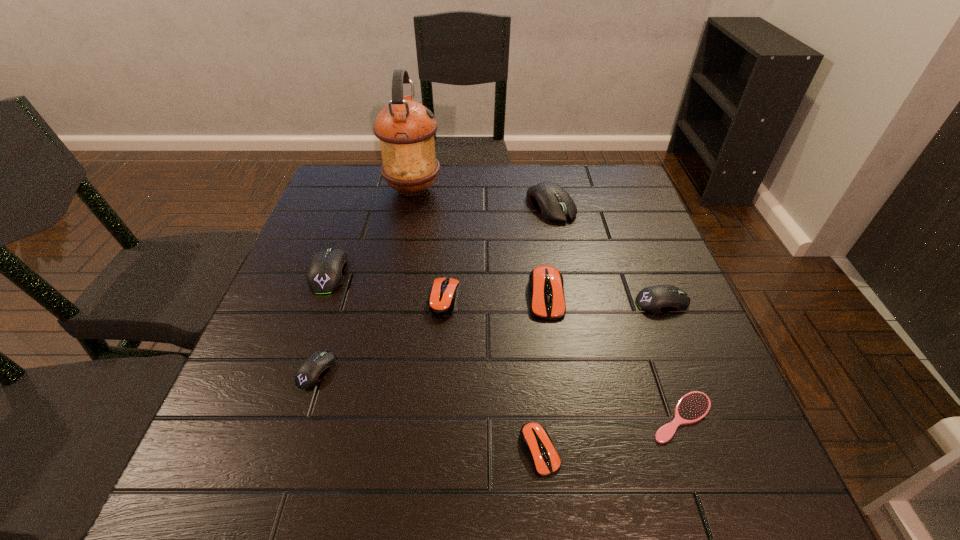
Where is `vacant space at the left edge of the desktop`? This screenshot has height=540, width=960. vacant space at the left edge of the desktop is located at coordinates (328, 326).

This screenshot has height=540, width=960. I want to click on free region at the right edge of the desktop, so click(x=707, y=370).

Where is `free space at the far left corner of the desktop`? free space at the far left corner of the desktop is located at coordinates (344, 176).

In the image, there is a desktop. At what (x,y) coordinates should I click in order to perform the action: click on vacant region at the far right corner. Please return your answer as a coordinate pair (x, y). The height and width of the screenshot is (540, 960). Looking at the image, I should click on (590, 179).

Find the location of a particular element. Image resolution: width=960 pixels, height=540 pixels. empty space between the hairbrush and the tallest computer mouse is located at coordinates (616, 311).

Find the location of `empty space between the second tallest object and the biggest orange computer mouse`. empty space between the second tallest object and the biggest orange computer mouse is located at coordinates (548, 250).

The image size is (960, 540). I want to click on vacant space that is in between the rightmost computer mouse and the third black computer equipment from left to right, so click(607, 254).

I want to click on free spot between the biggest black computer equipment and the third smallest black computer equipment, so click(x=440, y=239).

What are the coordinates of `vacant area that lies between the third nearest object and the third smallest black computer equipment` in the screenshot? It's located at (323, 321).

Image resolution: width=960 pixels, height=540 pixels. I want to click on free space that is in between the biggest orange computer mouse and the second nearest computer mouse, so click(431, 333).